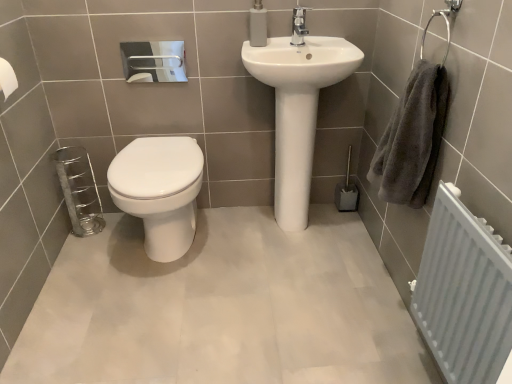
Where is `unoccupied area in front of white glossy toilet at center`? This screenshot has width=512, height=384. unoccupied area in front of white glossy toilet at center is located at coordinates (147, 309).